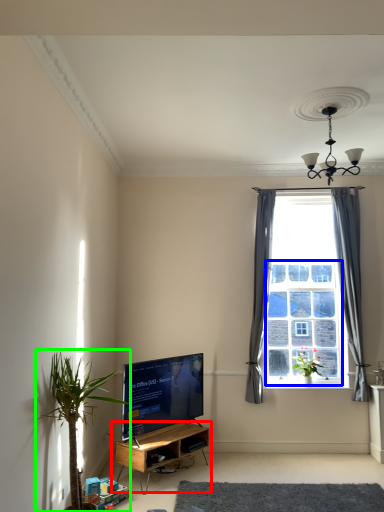
Question: Which is nearer to the shelf (highlighted by a red box)? bay window (highlighted by a blue box) or houseplant (highlighted by a green box).

Choices:
 (A) bay window
 (B) houseplant

Answer: (B)